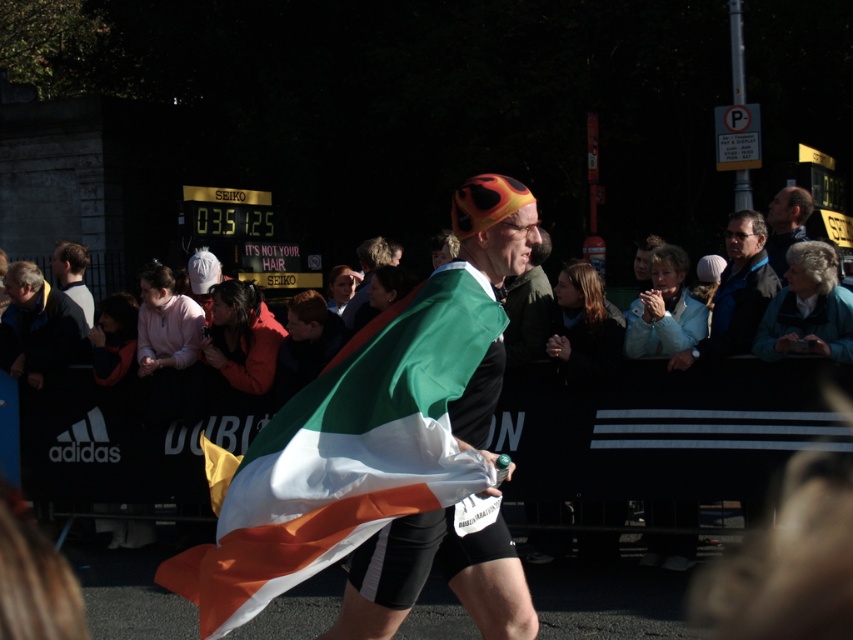
Who is more forward, (x=376, y=550) or (x=805, y=211)?

Point (x=376, y=550) is more forward.

Who is more distant from viewer, [508,218] or [780,253]?

The point [780,253] is more distant.

The image size is (853, 640). Find the location of `green fabric flag at center`. green fabric flag at center is located at coordinates (427, 573).

In order to click on green fabric flag at center in this screenshot , I will do `click(427, 573)`.

Does green fabric flag at center have a lesser height compared to gray fabric jacket at left?

No.

This screenshot has width=853, height=640. What do you see at coordinates (427, 573) in the screenshot?
I see `green fabric flag at center` at bounding box center [427, 573].

The width and height of the screenshot is (853, 640). In order to click on green fabric flag at center in this screenshot , I will do `click(427, 573)`.

Consider the image. Is irish flag at center below gray fabric jacket at left?

Yes, irish flag at center is below gray fabric jacket at left.

Does point (323, 417) come farther from viewer compared to point (62, 264)?

That is False.

You are a GUI agent. You are given a task and a screenshot of the screen. Output one action in this format:
    pyautogui.click(x=<x>, y=<y>)
    Task: Click on the irish flag at center
    This screenshot has width=853, height=640.
    Given the screenshot: What is the action you would take?
    pos(347,452)